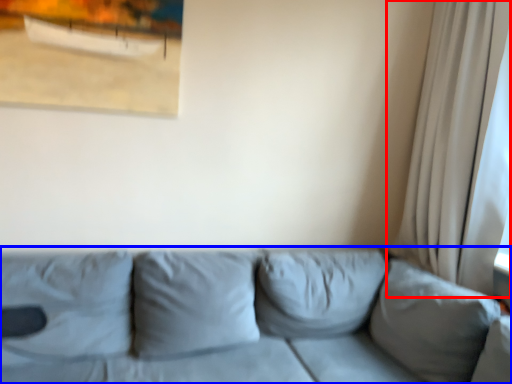
Question: Which point is further to the camera, curtain (highlighted by a red box) or studio couch (highlighted by a blue box)?

Choices:
 (A) curtain
 (B) studio couch

Answer: (A)